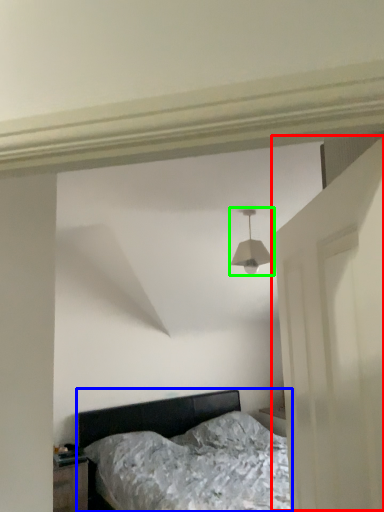
Question: Based on their relative distances, which object is nearer to door (highlighted by a red box)? Choose from bed (highlighted by a blue box) and lamp (highlighted by a green box).

Choices:
 (A) bed
 (B) lamp

Answer: (B)